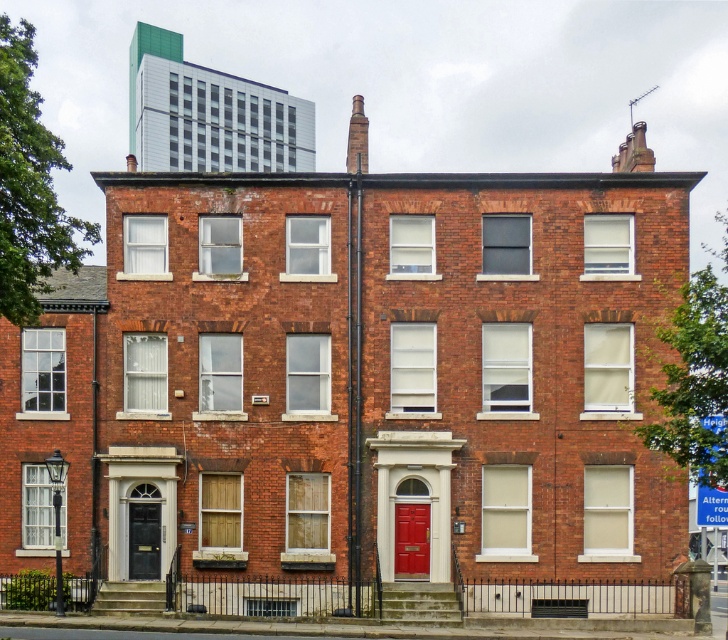
You are a delivery person who needs to enter the building through one of the doors. You see the matte red door at center and the matte black door at left. Which door is closer to the left side of the building?

The matte black door at left is closer to the left side of the building because it is positioned to the left of the matte red door at center.